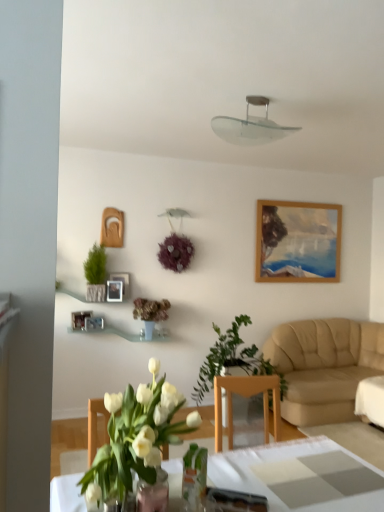
Question: Does wooden photo frame at upper left, the first picture frame in the right-to-left sequence, appear on the right side of clear glass lampshade at upper center?

Choices:
 (A) yes
 (B) no

Answer: (B)

Question: Is wooden photo frame at upper left, the first picture frame in the right-to-left sequence, located outside clear glass lampshade at upper center?

Choices:
 (A) yes
 (B) no

Answer: (A)

Question: Is wooden photo frame at upper left, the first picture frame in the right-to-left sequence, not close to clear glass lampshade at upper center?

Choices:
 (A) yes
 (B) no

Answer: (A)

Question: Does wooden photo frame at upper left, the first picture frame in the right-to-left sequence, turn towards clear glass lampshade at upper center?

Choices:
 (A) no
 (B) yes

Answer: (A)

Question: Considering the relative sizes of wooden photo frame at upper left, the first picture frame in the right-to-left sequence, and clear glass lampshade at upper center in the image provided, is wooden photo frame at upper left, the first picture frame in the right-to-left sequence, bigger than clear glass lampshade at upper center?

Choices:
 (A) no
 (B) yes

Answer: (A)

Question: From the image's perspective, is green leafy plant at center, which ranks as the 4th houseplant in left-to-right order, located above or below wooden photo frame at upper center, which ranks as the second picture frame in right-to-left order?

Choices:
 (A) above
 (B) below

Answer: (B)

Question: Considering the relative positions of green leafy plant at center, placed as the 1th houseplant when sorted from right to left, and wooden photo frame at upper center, which ranks as the second picture frame in right-to-left order, in the image provided, is green leafy plant at center, placed as the 1th houseplant when sorted from right to left, to the left or to the right of wooden photo frame at upper center, which ranks as the second picture frame in right-to-left order,?

Choices:
 (A) right
 (B) left

Answer: (A)

Question: Relative to wooden photo frame at upper center, the second picture frame when ordered from left to right, is green leafy plant at center, the 2th houseplant in the front-to-back sequence, in front or behind?

Choices:
 (A) front
 (B) behind

Answer: (A)

Question: Looking at their shapes, would you say green leafy plant at center, placed as the 1th houseplant when sorted from right to left, is wider or thinner than wooden photo frame at upper center, which ranks as the second picture frame in right-to-left order?

Choices:
 (A) thin
 (B) wide

Answer: (B)

Question: In the image, is clear glass lampshade at upper center on the left side or the right side of wooden photo frame at upper center, which ranks as the second picture frame in right-to-left order?

Choices:
 (A) left
 (B) right

Answer: (B)

Question: From the image's perspective, is clear glass lampshade at upper center above or below wooden photo frame at upper center, which ranks as the second picture frame in right-to-left order?

Choices:
 (A) below
 (B) above

Answer: (B)

Question: Is clear glass lampshade at upper center bigger or smaller than wooden photo frame at upper center, which ranks as the second picture frame in right-to-left order?

Choices:
 (A) small
 (B) big

Answer: (B)

Question: From a real-world perspective, is clear glass lampshade at upper center physically located above or below wooden photo frame at upper center, the second picture frame when ordered from left to right?

Choices:
 (A) above
 (B) below

Answer: (A)

Question: Which is correct: wooden photo frame at upper left, the first picture frame in the right-to-left sequence, is inside wooden photo frame at upper left, which is the 1th picture frame from left to right, or outside of it?

Choices:
 (A) inside
 (B) outside

Answer: (B)

Question: Does point [115, 280] appear closer or farther from the camera than point [77, 322]?

Choices:
 (A) closer
 (B) farther

Answer: (B)